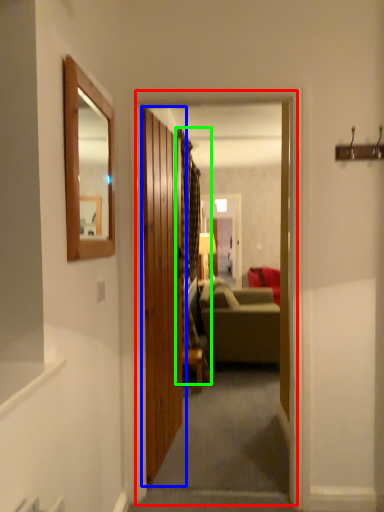
Question: Based on their relative distances, which object is nearer to corridor (highlighted by a red box)? Choose from door (highlighted by a blue box) and curtain (highlighted by a green box).

Choices:
 (A) door
 (B) curtain

Answer: (B)